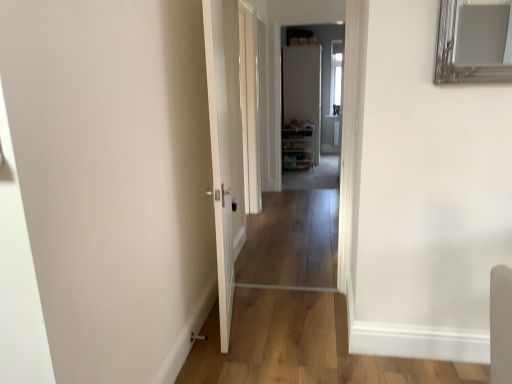
Question: Is clear glass door at center bigger or smaller than white glossy door at upper center, which is the 2th door in front-to-back order?

Choices:
 (A) small
 (B) big

Answer: (B)

Question: In the image, is clear glass door at center on the left side or the right side of white glossy door at upper center, the 1th door in the right-to-left sequence?

Choices:
 (A) left
 (B) right

Answer: (A)

Question: Considering the real-world distances, which object is farthest from the white glossy door at center, the first door viewed from the front?

Choices:
 (A) clear glass door at center
 (B) white glossy door at upper center, which is the 2th door in front-to-back order

Answer: (B)

Question: Estimate the real-world distances between objects in this image. Which object is closer to the white glossy door at center, the first door viewed from the front?

Choices:
 (A) white glossy door at upper center, which is the 2th door in front-to-back order
 (B) clear glass door at center

Answer: (B)